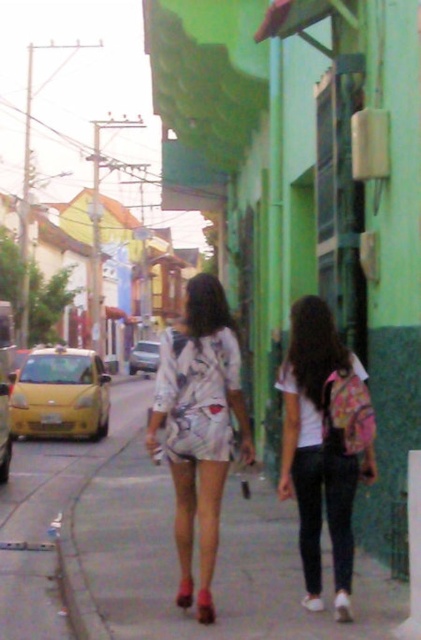
Consider the image. Can you confirm if smooth concrete sidewalk at center is thinner than printed fabric dress at center?

Indeed, smooth concrete sidewalk at center has a lesser width compared to printed fabric dress at center.

How far apart are smooth concrete sidewalk at center and printed fabric dress at center?

smooth concrete sidewalk at center is 3.19 meters from printed fabric dress at center.

Is point (247, 596) in front of point (247, 454)?

No, it is not.

This screenshot has height=640, width=421. I want to click on smooth concrete sidewalk at center, so [215, 566].

Is point (338, 378) more distant than point (205, 572)?

No, it is not.

Who is more distant from viewer, (316,600) or (226,340)?

The point (226,340) is behind.

Image resolution: width=421 pixels, height=640 pixels. Describe the element at coordinates (324, 444) in the screenshot. I see `white matte shirt at center` at that location.

Where is `white matte shirt at center`? The height and width of the screenshot is (640, 421). white matte shirt at center is located at coordinates (324, 444).

Find the location of a particular element. Image resolution: width=421 pixels, height=640 pixels. smooth concrete sidewalk at center is located at coordinates (215, 566).

Measure the distance between smooth concrete sidewalk at center and white matte shirt at center.

smooth concrete sidewalk at center and white matte shirt at center are 2.93 meters apart from each other.

Between point (397, 592) and point (312, 492), which one is positioned behind?

The point (397, 592) is behind.

Find the location of a particular element. The width and height of the screenshot is (421, 640). smooth concrete sidewalk at center is located at coordinates (215, 566).